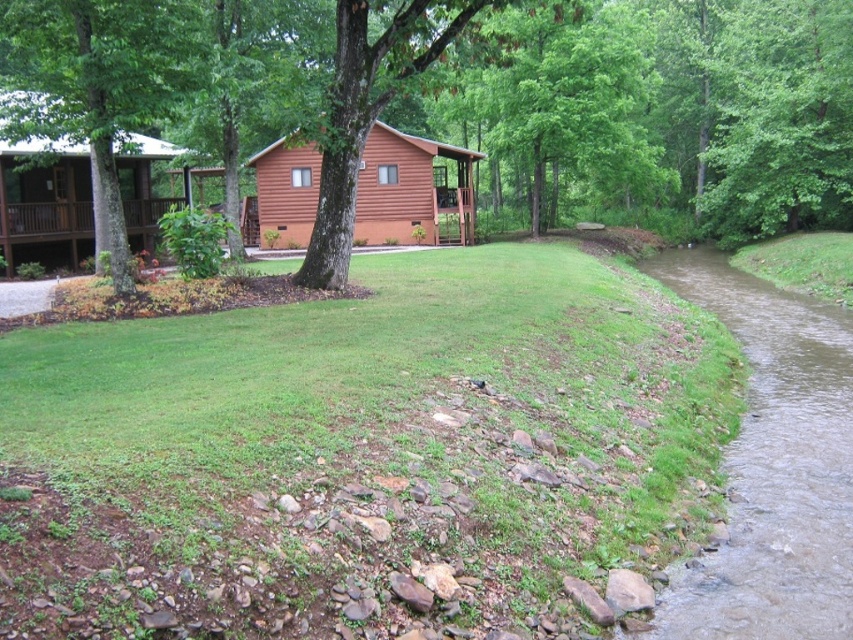
You are standing in front of the rustic wooden cabin with a light colored roof. You want to plant a new tree exactly 10 meters away from where you are standing. Can you determine if the green leafy tree at center is within the desired planting distance?

The green leafy tree at center is 11.80 meters from viewer, which is beyond the desired 10 meters distance. Therefore, it is not within the desired planting distance.